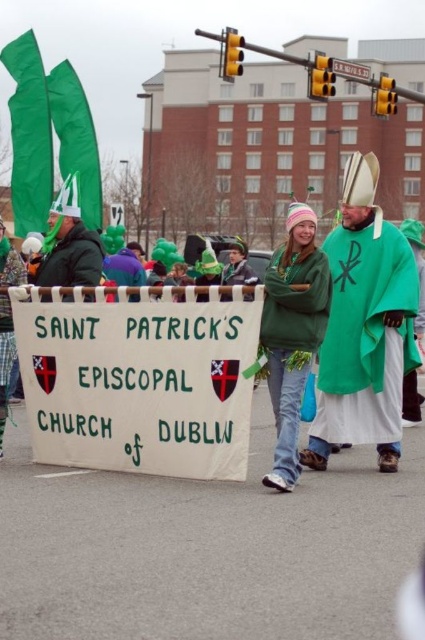
Question: Which object is farther from the camera taking this photo?

Choices:
 (A) white paper banner at center
 (B) green fleece sweater at center

Answer: (A)

Question: Does white paper banner at center have a smaller size compared to green fabric cape at center?

Choices:
 (A) yes
 (B) no

Answer: (B)

Question: Does white paper banner at center appear over green fleece sweater at center?

Choices:
 (A) no
 (B) yes

Answer: (B)

Question: Which object appears farthest from the camera in this image?

Choices:
 (A) green fabric cape at center
 (B) white paper banner at center

Answer: (A)

Question: Is green fabric cape at center further to the viewer compared to green fleece sweater at center?

Choices:
 (A) yes
 (B) no

Answer: (A)

Question: Which object appears closest to the camera in this image?

Choices:
 (A) green fabric cape at center
 (B) green fleece sweater at center
 (C) white paper banner at center

Answer: (B)